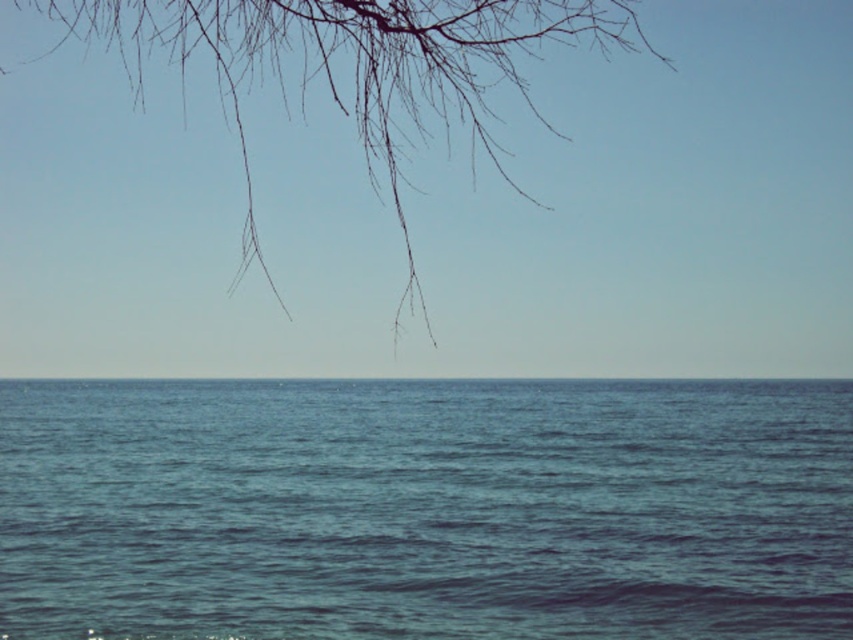
Looking at this image, you are a swimmer who wants to reach the point marked at coordinates point (425,508). Based on the scene description, what is the nature of the surface you will encounter at that point?

The point (425,508) is on blue liquid water at center, so the surface you will encounter is liquid water.

You are a bird flying over the seascape. You see the blue liquid water at center and the bare branches at upper left. Which object is located lower in the image?

The blue liquid water at center is located lower than the bare branches at upper left in the image.

You are an artist trying to paint the seascape. You want to ensure the blue liquid water at center and the bare branches at upper left are proportionally accurate. Which object should you paint first if you want to allocate more canvas space to the larger one?

The bare branches at upper left should be painted first since they occupy more space than the blue liquid water at center according to the description.